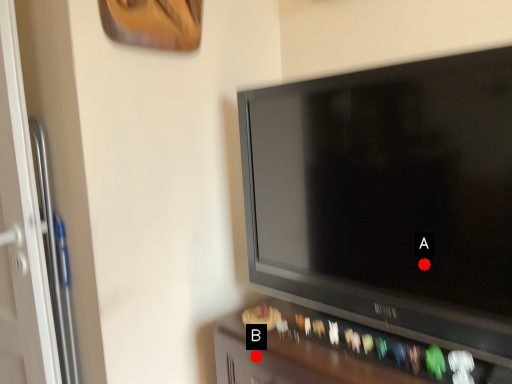
Question: Two points are circled on the image, labeled by A and B beside each circle. Which point is farther to the camera?

Choices:
 (A) A is further
 (B) B is further

Answer: (B)